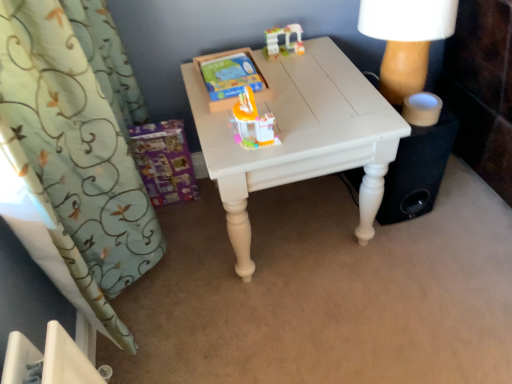
Locate an element on the screen. This screenshot has width=512, height=384. free space on the front side of white painted wood table at center is located at coordinates (322, 327).